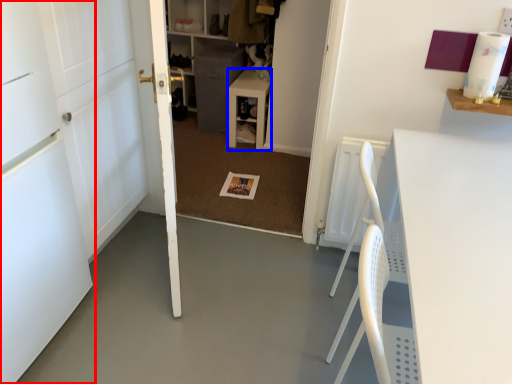
Question: Which object appears farthest to the camera in this image, door (highlighted by a red box) or table (highlighted by a blue box)?

Choices:
 (A) door
 (B) table

Answer: (B)